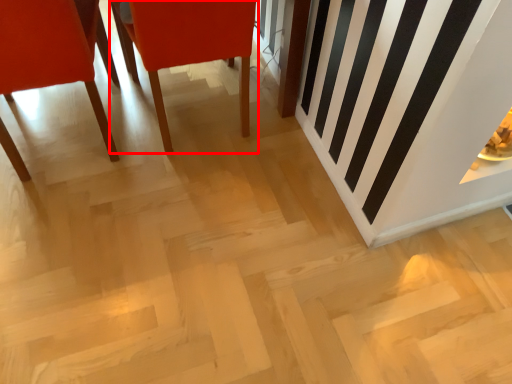
Question: From the image's perspective, what is the correct spatial positioning of chair (annotated by the red box) in reference to chair?

Choices:
 (A) below
 (B) above

Answer: (B)